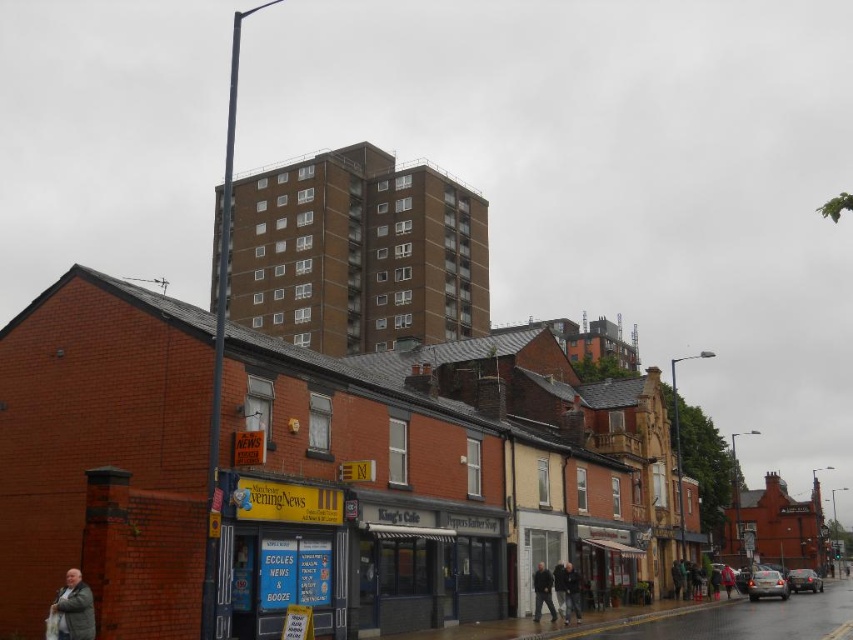
You are a pedestrian standing on the street looking at the shops. You see a gray wool coat at lower left and a dark gray jacket at center. Which clothing item is nearer to you?

The gray wool coat at lower left is closer to the viewer than the dark gray jacket at center.

You are standing on the street looking at the row of shops. There are two points marked on the image. One is at point (86,611) and the other is at point (540,580). Which point is closer to you?

Point (86,611) is closer to the camera than point (540,580).